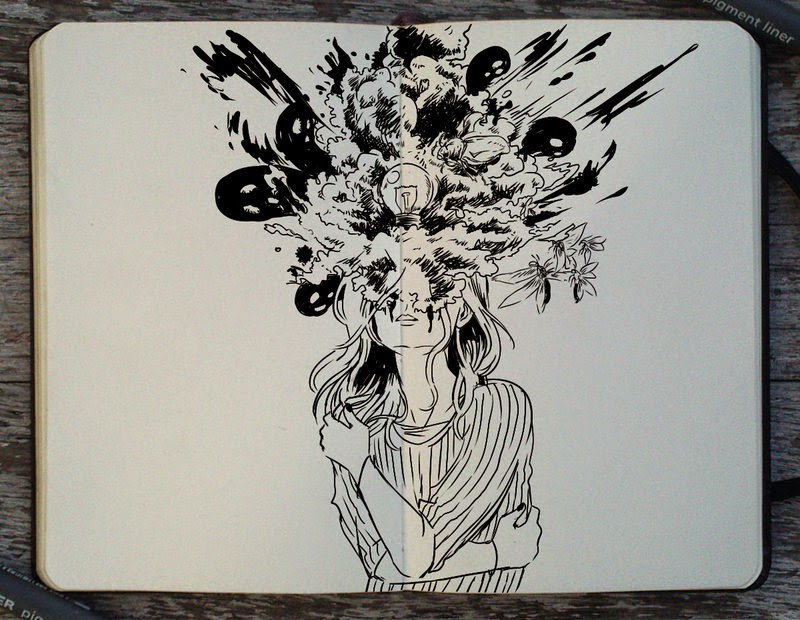
The height and width of the screenshot is (620, 800). I want to click on wooden desk, so click(x=789, y=386), click(x=16, y=340).